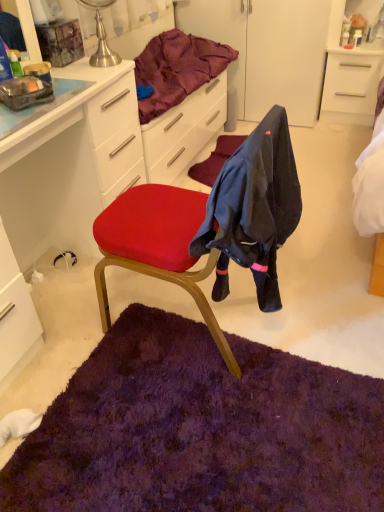
Question: Does white glossy cabinet at upper right, the second cabinetry when ordered from front to back, have a greater width compared to velvet red chair at center?

Choices:
 (A) no
 (B) yes

Answer: (A)

Question: Considering the relative positions of white glossy cabinet at upper right, the second cabinetry when ordered from front to back, and velvet red chair at center in the image provided, is white glossy cabinet at upper right, the second cabinetry when ordered from front to back, to the right of velvet red chair at center from the viewer's perspective?

Choices:
 (A) no
 (B) yes

Answer: (B)

Question: Would you say velvet red chair at center is part of white glossy cabinet at upper right, positioned as the 2th cabinetry in bottom-to-top order,'s contents?

Choices:
 (A) yes
 (B) no

Answer: (B)

Question: Is velvet red chair at center at the back of white glossy cabinet at upper right, positioned as the 2th cabinetry in bottom-to-top order?

Choices:
 (A) yes
 (B) no

Answer: (B)

Question: From a real-world perspective, is white glossy cabinet at upper right, acting as the 1th cabinetry starting from the back, beneath velvet red chair at center?

Choices:
 (A) yes
 (B) no

Answer: (A)

Question: Would you say velvet purple blanket at upper center is to the left or to the right of white glossy cabinet at left, placed as the 1th cabinetry when sorted from left to right, in the picture?

Choices:
 (A) right
 (B) left

Answer: (A)

Question: Is velvet purple blanket at upper center wider or thinner than white glossy cabinet at left, arranged as the 1th cabinetry when viewed from the front?

Choices:
 (A) wide
 (B) thin

Answer: (B)

Question: Is point (193, 37) positioned closer to the camera than point (49, 241)?

Choices:
 (A) farther
 (B) closer

Answer: (A)

Question: Choose the correct answer: Is velvet purple blanket at upper center inside white glossy cabinet at left, the 2th cabinetry viewed from the right, or outside it?

Choices:
 (A) outside
 (B) inside

Answer: (A)

Question: From the image's perspective, is velvet purple blanket at upper center above or below white glossy cabinet at upper right, the second cabinetry when ordered from left to right?

Choices:
 (A) above
 (B) below

Answer: (B)

Question: From their relative heights in the image, would you say velvet purple blanket at upper center is taller or shorter than white glossy cabinet at upper right, the second cabinetry when ordered from left to right?

Choices:
 (A) tall
 (B) short

Answer: (B)

Question: In the image, is velvet purple blanket at upper center on the left side or the right side of white glossy cabinet at upper right, positioned as the 2th cabinetry in bottom-to-top order?

Choices:
 (A) right
 (B) left

Answer: (B)

Question: Does point (x=175, y=56) appear closer or farther from the camera than point (x=359, y=120)?

Choices:
 (A) closer
 (B) farther

Answer: (A)

Question: Is purple shaggy mat at lower center wider or thinner than dark blue fabric at center?

Choices:
 (A) thin
 (B) wide

Answer: (B)

Question: From the image's perspective, is purple shaggy mat at lower center above or below dark blue fabric at center?

Choices:
 (A) above
 (B) below

Answer: (B)